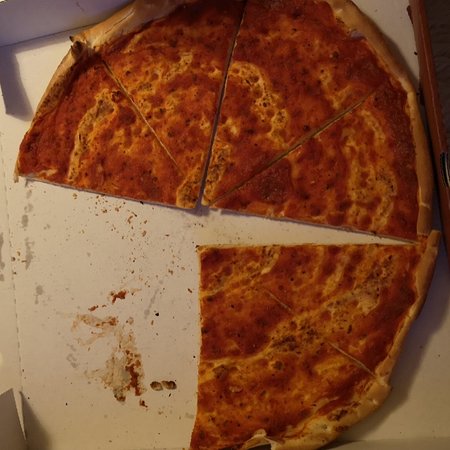
Find the location of `table`. table is located at coordinates pyautogui.click(x=443, y=46).